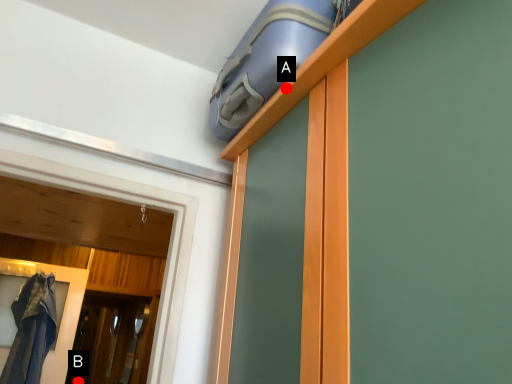
Question: Two points are circled on the image, labeled by A and B beside each circle. Which point is farther from the camera taking this photo?

Choices:
 (A) A is further
 (B) B is further

Answer: (B)